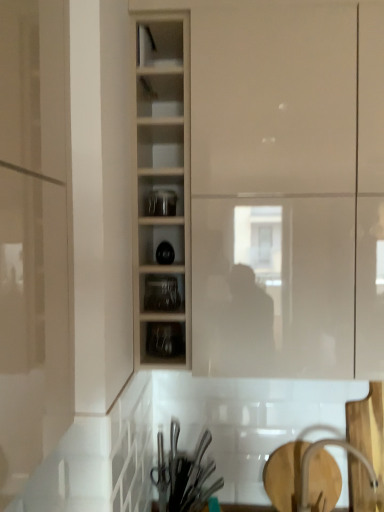
Question: Should I look upward or downward to see clear glass jars at center, which is the 1th shelf from bottom to top?

Choices:
 (A) down
 (B) up

Answer: (A)

Question: Does matte white cupboard at center appear on the left side of transparent glass jars at center, the 2th tableware from the bottom?

Choices:
 (A) yes
 (B) no

Answer: (B)

Question: Can you confirm if matte white cupboard at center is taller than transparent glass jars at center, the 2th tableware from the back?

Choices:
 (A) no
 (B) yes

Answer: (B)

Question: Is transparent glass jars at center, which ranks as the 1th tableware in top-to-bottom order, at the back of matte white cupboard at center?

Choices:
 (A) yes
 (B) no

Answer: (B)

Question: From the image's perspective, is matte white cupboard at center under transparent glass jars at center, which ranks as the 1th tableware in top-to-bottom order?

Choices:
 (A) yes
 (B) no

Answer: (B)

Question: From the image's perspective, is matte white cupboard at center located above transparent glass jars at center, which ranks as the 1th tableware in top-to-bottom order?

Choices:
 (A) yes
 (B) no

Answer: (A)

Question: From a real-world perspective, is matte white cupboard at center on top of transparent glass jars at center, which ranks as the 1th tableware in top-to-bottom order?

Choices:
 (A) no
 (B) yes

Answer: (B)

Question: From a real-world perspective, is clear glass jars at center, the 2th shelf viewed from the top, below clear glass jars at center, the first shelf in the top-to-bottom sequence?

Choices:
 (A) yes
 (B) no

Answer: (A)

Question: Is clear glass jars at center, the 2th shelf viewed from the top, at the left side of clear glass jars at center, the first shelf in the top-to-bottom sequence?

Choices:
 (A) no
 (B) yes

Answer: (A)

Question: Can you confirm if clear glass jars at center, the 2th shelf viewed from the top, is shorter than clear glass jars at center, which ranks as the second shelf in bottom-to-top order?

Choices:
 (A) no
 (B) yes

Answer: (A)

Question: Is clear glass jars at center, the 2th shelf viewed from the top, wider than clear glass jars at center, the first shelf in the top-to-bottom sequence?

Choices:
 (A) no
 (B) yes

Answer: (A)

Question: Is clear glass jars at center, the 2th shelf viewed from the top, facing away from clear glass jars at center, which ranks as the second shelf in bottom-to-top order?

Choices:
 (A) yes
 (B) no

Answer: (B)

Question: Considering the relative sizes of clear glass jars at center, which is the 1th shelf from bottom to top, and clear glass jars at center, which ranks as the second shelf in bottom-to-top order, in the image provided, is clear glass jars at center, which is the 1th shelf from bottom to top, bigger than clear glass jars at center, which ranks as the second shelf in bottom-to-top order,?

Choices:
 (A) yes
 (B) no

Answer: (A)

Question: Does clear glass jars at center, the first shelf in the top-to-bottom sequence, have a greater width compared to matte white cupboard at center?

Choices:
 (A) no
 (B) yes

Answer: (A)